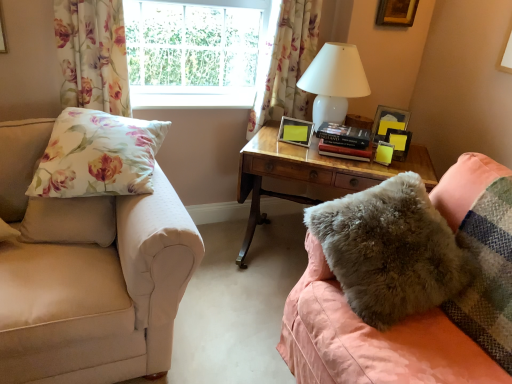
Question: From the image's perspective, is wooden picture frame at upper right, acting as the 4th picture frame starting from the left, above or below floral fabric pillow at left, the 1th pillow when ordered from left to right?

Choices:
 (A) above
 (B) below

Answer: (A)

Question: In terms of width, does wooden picture frame at upper right, placed as the fourth picture frame when sorted from bottom to top, look wider or thinner when compared to floral fabric pillow at left, the 1th pillow when ordered from left to right?

Choices:
 (A) thin
 (B) wide

Answer: (A)

Question: Which object is the closest to the wooden desk at center?

Choices:
 (A) clear glass window at upper center
 (B) floral fabric pillow at left, placed as the 2th pillow when sorted from right to left
 (C) white glossy table lamp at upper right
 (D) hardcover book at center
 (E) matte wooden picture frame at center, the first picture frame from the left

Answer: (D)

Question: Which of these objects is positioned closest to the wooden desk at center?

Choices:
 (A) yellow matte picture frame at upper right, marked as the first picture frame in a bottom-to-top arrangement
 (B) matte wooden picture frame at center, which is the 4th picture frame from right to left
 (C) fuzzy gray pillow at lower right, the 2th pillow in the left-to-right sequence
 (D) matte black picture frame at upper right, which is the 3th picture frame in bottom-to-top order
 (E) floral fabric pillow at left, placed as the 2th pillow when sorted from right to left

Answer: (B)